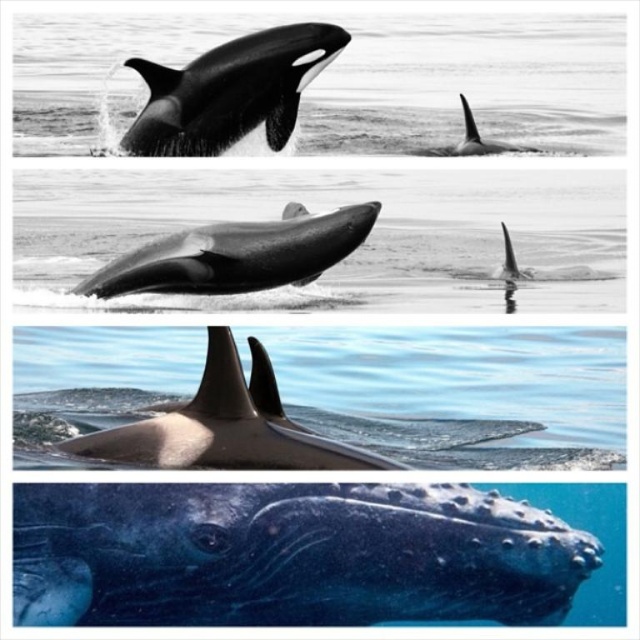
Question: Which object is the closest to the smooth black dolphin at center?

Choices:
 (A) smooth gray dolphin at bottom right
 (B) black smooth dolphin at upper center
 (C) black smooth orca at upper left
 (D) smooth gray dolphin at center

Answer: (A)

Question: Can you confirm if smooth gray dolphin at bottom right is positioned to the right of black smooth orca at upper left?

Choices:
 (A) yes
 (B) no

Answer: (A)

Question: Among these objects, which one is farthest from the camera?

Choices:
 (A) black smooth orca at upper left
 (B) black smooth dolphin at upper center
 (C) smooth black dolphin at center

Answer: (B)

Question: In this image, where is black smooth orca at upper left located relative to smooth gray dolphin at center?

Choices:
 (A) right
 (B) left

Answer: (B)

Question: Where is smooth gray dolphin at bottom right located in relation to black smooth orca at upper left in the image?

Choices:
 (A) above
 (B) below

Answer: (B)

Question: Estimate the real-world distances between objects in this image. Which object is closer to the smooth gray dolphin at center?

Choices:
 (A) black smooth orca at upper left
 (B) smooth black dolphin at center

Answer: (A)